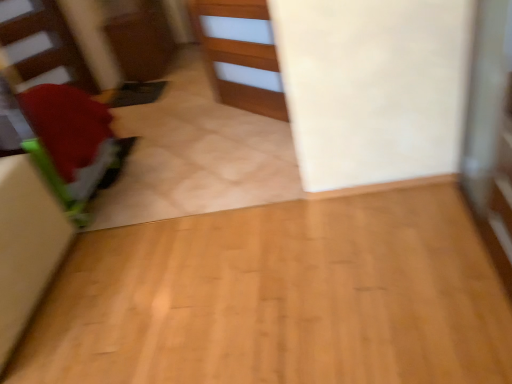
Question: Is matte red stairwell at left completely or partially outside of green fabric cushion at left?

Choices:
 (A) no
 (B) yes

Answer: (B)

Question: Does matte red stairwell at left turn towards green fabric cushion at left?

Choices:
 (A) yes
 (B) no

Answer: (A)

Question: Can you confirm if matte red stairwell at left is thinner than green fabric cushion at left?

Choices:
 (A) yes
 (B) no

Answer: (A)

Question: Is matte red stairwell at left at the left side of green fabric cushion at left?

Choices:
 (A) yes
 (B) no

Answer: (A)

Question: From the image's perspective, does matte red stairwell at left appear lower than green fabric cushion at left?

Choices:
 (A) no
 (B) yes

Answer: (A)

Question: Considering the relative sizes of matte red stairwell at left and green fabric cushion at left in the image provided, is matte red stairwell at left wider than green fabric cushion at left?

Choices:
 (A) yes
 (B) no

Answer: (B)

Question: Can you confirm if matte red stairwell at left is bigger than wooden cabinet at center?

Choices:
 (A) yes
 (B) no

Answer: (B)

Question: Is matte red stairwell at left placed right next to wooden cabinet at center?

Choices:
 (A) yes
 (B) no

Answer: (B)

Question: Is matte red stairwell at left wider than wooden cabinet at center?

Choices:
 (A) yes
 (B) no

Answer: (A)

Question: Can you confirm if matte red stairwell at left is shorter than wooden cabinet at center?

Choices:
 (A) yes
 (B) no

Answer: (B)

Question: Is matte red stairwell at left located outside wooden cabinet at center?

Choices:
 (A) yes
 (B) no

Answer: (A)

Question: Is matte red stairwell at left surrounding wooden cabinet at center?

Choices:
 (A) no
 (B) yes

Answer: (A)

Question: From a real-world perspective, is wooden cabinet at center over green fabric cushion at left?

Choices:
 (A) yes
 (B) no

Answer: (B)